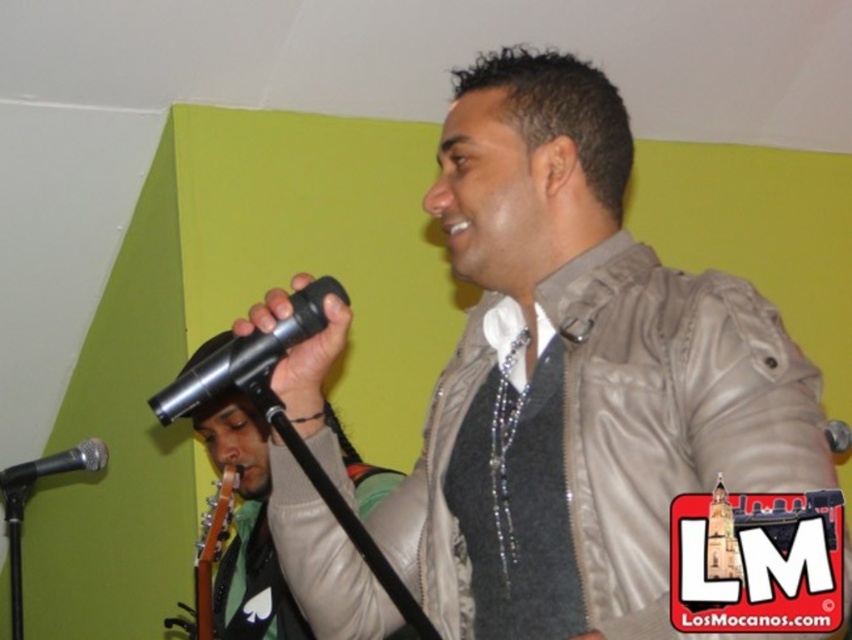
You are a photographer standing at the center of the stage. You want to take a photo that includes both the point at (x=242, y=611) and the point at (x=88, y=468). Which point should you focus on first to ensure both are in the frame?

You should focus on point (x=242, y=611) first because it is in front of point (x=88, y=468), so by centering the camera on the closer point, you can adjust the frame to include both points.

You are a stagehand setting up a spotlight for the performer wearing the matte beige jacket at center. The spotlight is placed at a height of 3 meters. Can you confirm if the spotlight will illuminate the top of the metallic silver microphone at left?

The matte beige jacket at center is taller than the metallic silver microphone at left. Since the spotlight is at 3 meters, which is above both objects, it can illuminate the top of the metallic silver microphone at left as long as there is a clear line of sight.

Looking at this image, you are a stagehand who needs to place a new microphone stand in the center of the stage. The current shiny metallic microphone at center is already there. Considering the space occupied by the matte beige jacket at center, can you fit the new stand next to the existing microphone?

The matte beige jacket at center is wider than the shiny metallic microphone at center. Since the jacket is already occupying more space, there might not be enough room to place the new stand next to the existing microphone without overlapping.